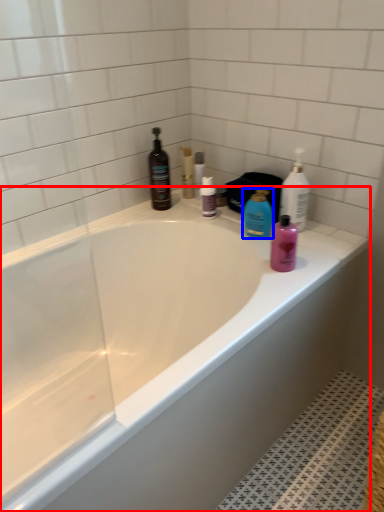
Question: Which of the following is the closest to the observer, bathtub (highlighted by a red box) or cleaning product (highlighted by a blue box)?

Choices:
 (A) bathtub
 (B) cleaning product

Answer: (A)